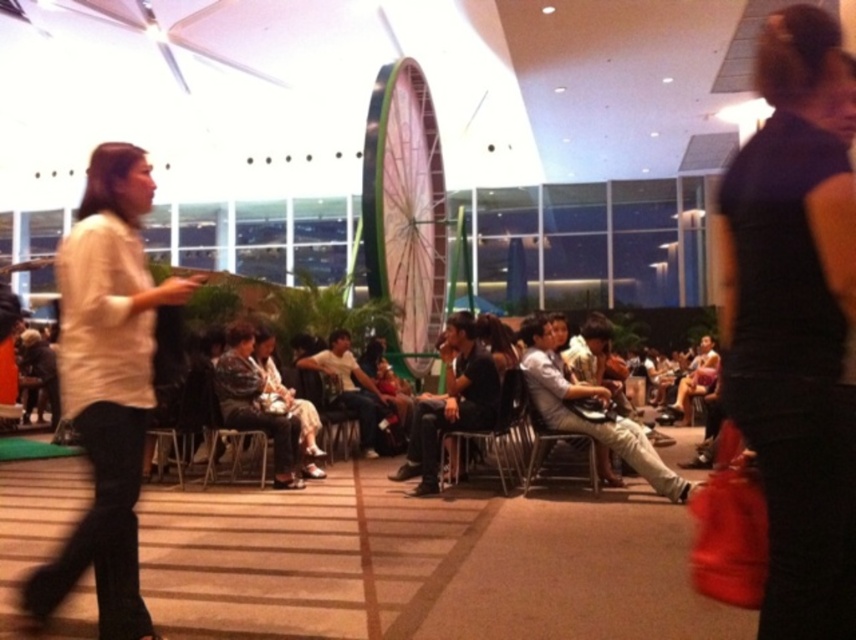
In the scene shown: You are sitting in the wooden chair at center and want to hand a document to someone sitting in the black plastic chair at center. Which direction should you pass the document to reach them?

The black plastic chair at center is closer to the viewer than the wooden chair at center, so you should pass the document forward towards the viewer.

You are standing at the entrance of the event space and see the black fabric dress at right. If you want to walk directly towards it, which direction should you move relative to your current position?

Since the black fabric dress at right is located at point 0.502 on the x axis and 0.931 on the y axis, you should move towards the right and slightly forward to reach it.

You are sitting in the conference hall and need to choose a chair to sit on. The black plastic chair at center and the metallic silver chair at center are available. Which chair is taller?

The black plastic chair at center is taller than the metallic silver chair at center.